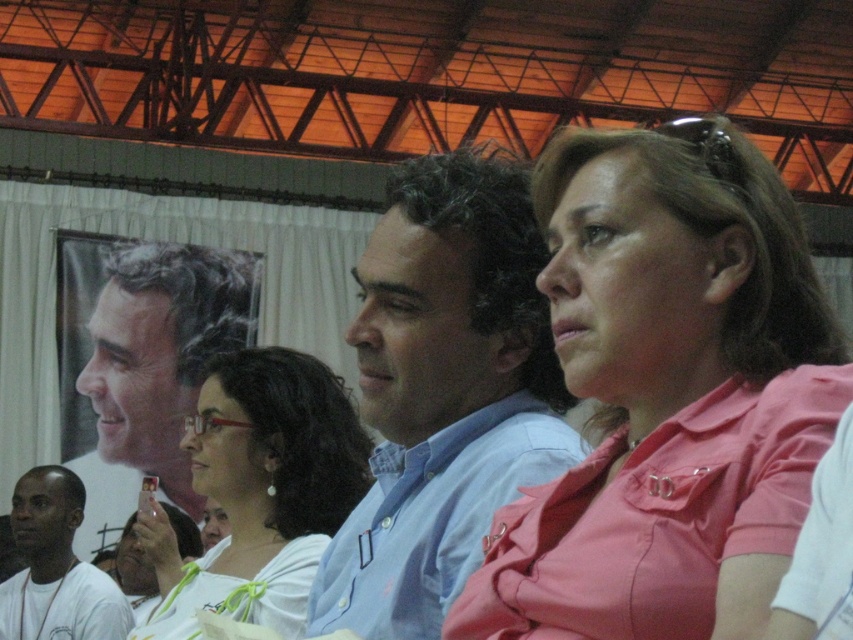
Is pink fabric shirt at center positioned in front of white fabric shirt at center?

Yes, pink fabric shirt at center is closer to the viewer.

At what (x,y) coordinates should I click in order to perform the action: click on pink fabric shirt at center. Please return your answer as a coordinate pair (x, y). Looking at the image, I should click on (666, 392).

You are a GUI agent. You are given a task and a screenshot of the screen. Output one action in this format:
    pyautogui.click(x=<x>, y=<y>)
    Task: Click on the pink fabric shirt at center
    The image size is (853, 640).
    Given the screenshot: What is the action you would take?
    pyautogui.click(x=666, y=392)

Who is more forward, (380, 422) or (65, 564)?

Point (380, 422)

Which is below, light blue shirt at center or white matte shirt at lower left?

white matte shirt at lower left is lower down.

Does point (463, 300) come behind point (57, 492)?

No, it is not.

You are a GUI agent. You are given a task and a screenshot of the screen. Output one action in this format:
    pyautogui.click(x=<x>, y=<y>)
    Task: Click on the light blue shirt at center
    This screenshot has width=853, height=640.
    Given the screenshot: What is the action you would take?
    pyautogui.click(x=444, y=392)

Can you confirm if pink fabric shirt at center is wider than light blue shirt at center?

Yes, pink fabric shirt at center is wider than light blue shirt at center.

The height and width of the screenshot is (640, 853). I want to click on pink fabric shirt at center, so click(x=666, y=392).